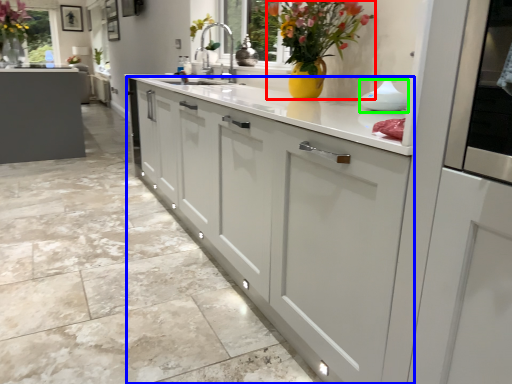
Question: Which is farther away from floral arrangement (highlighted by a red box)? cabinetry (highlighted by a blue box) or appliance (highlighted by a green box)?

Choices:
 (A) cabinetry
 (B) appliance

Answer: (A)